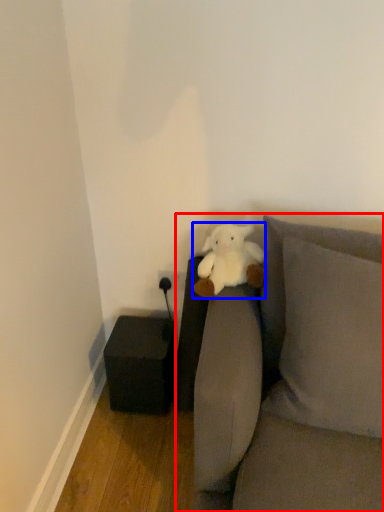
Question: Which object appears farthest to the camera in this image, studio couch (highlighted by a red box) or teddy bear (highlighted by a blue box)?

Choices:
 (A) studio couch
 (B) teddy bear

Answer: (B)